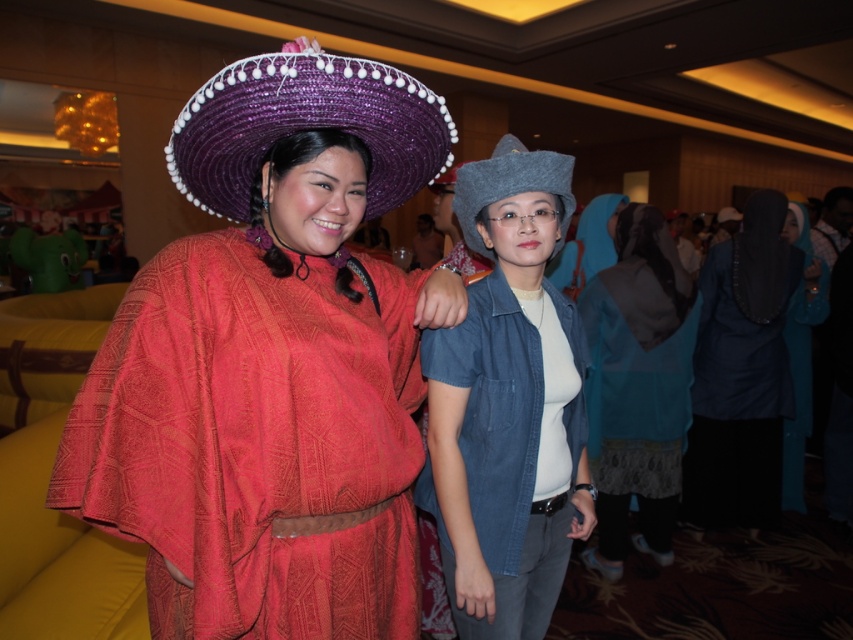
Question: Which object appears farthest from the camera in this image?

Choices:
 (A) dark blue fabric hijab at right
 (B) purple straw sombrero at upper left
 (C) matte red fabric dress at center

Answer: (A)

Question: Which object is farther from the camera taking this photo?

Choices:
 (A) blue textured dress at center
 (B) dark blue fabric hijab at right
 (C) matte red fabric dress at center

Answer: (B)

Question: Is blue textured dress at center positioned in front of gray felt cowboy hat at center?

Choices:
 (A) no
 (B) yes

Answer: (A)

Question: Considering the real-world distances, which object is farthest from the purple straw sombrero at upper left?

Choices:
 (A) gray felt cowboy hat at center
 (B) teal fabric hijab at right
 (C) matte red fabric dress at center
 (D) dark blue fabric hijab at right

Answer: (B)

Question: Is purple straw sombrero at upper left in front of gray felt cowboy hat at center?

Choices:
 (A) yes
 (B) no

Answer: (A)

Question: From the image, what is the correct spatial relationship of denim jacket at center in relation to blue textured dress at center?

Choices:
 (A) left
 (B) right

Answer: (A)